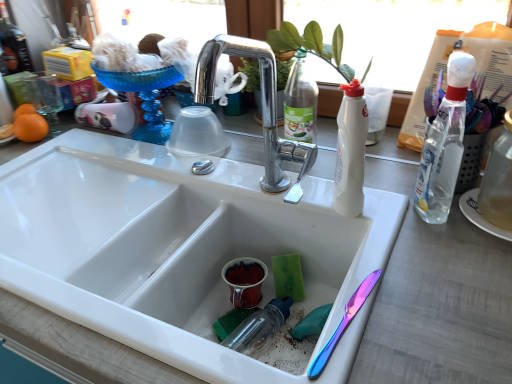
Question: From a real-world perspective, is clear plastic bottle at right, the second bottle when ordered from right to left, physically located above or below orange matte at left?

Choices:
 (A) above
 (B) below

Answer: (A)

Question: In the image, is clear plastic bottle at right, the second bottle when ordered from right to left, on the left side or the right side of orange matte at left?

Choices:
 (A) left
 (B) right

Answer: (B)

Question: Based on their relative distances, which object is farther from the orange matte at left?

Choices:
 (A) clear glass bottle at right, positioned as the first bottle in right-to-left order
 (B) clear plastic bottle at right, the 2th bottle from the left
 (C) white matte bottle at center, the 3th bottle positioned from the right
 (D) iridescent metallic knife at lower right
 (E) white glossy sink at center

Answer: (A)

Question: Estimate the real-world distances between objects in this image. Which object is farther from the clear plastic bottle at right, the second bottle when ordered from right to left?

Choices:
 (A) white matte bottle at center, the 3th bottle positioned from the right
 (B) green leafy plant at upper center
 (C) iridescent metallic knife at lower right
 (D) white glossy sink at center
 (E) orange matte at left

Answer: (E)